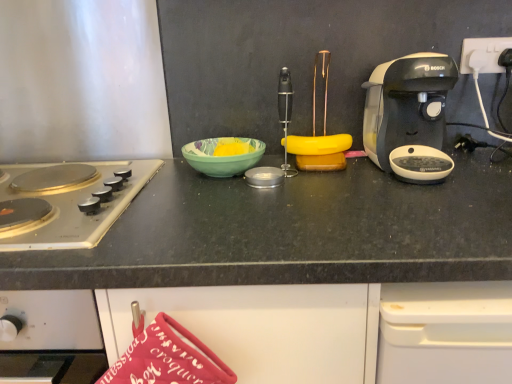
Where is `vacant area that is in front of black plastic coffee maker at right`? The width and height of the screenshot is (512, 384). vacant area that is in front of black plastic coffee maker at right is located at coordinates (437, 198).